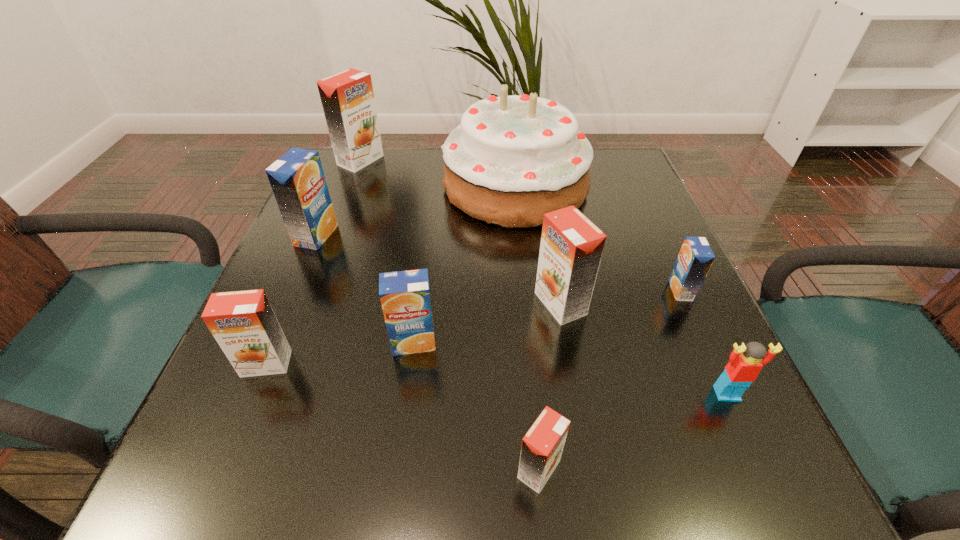
At what (x,y) coordinates should I click in order to perform the action: click on object that is at the far left corner. Please return your answer as a coordinate pair (x, y). The width and height of the screenshot is (960, 540). Looking at the image, I should click on (347, 98).

Locate an element on the screen. The width and height of the screenshot is (960, 540). object located at the far right corner is located at coordinates (512, 159).

Where is `vacant region at the near edge of the desktop`? The image size is (960, 540). vacant region at the near edge of the desktop is located at coordinates (350, 442).

You are a GUI agent. You are given a task and a screenshot of the screen. Output one action in this format:
    pyautogui.click(x=<x>, y=<y>)
    Task: Click on the vacant space at the left edge of the desktop
    
    Given the screenshot: What is the action you would take?
    pos(252,423)

The image size is (960, 540). In the image, there is a desktop. What are the coordinates of `vacant space at the right edge` in the screenshot? It's located at (646, 292).

The image size is (960, 540). Identify the location of vacant space at the near right corner. (733, 496).

Locate an element on the screen. This screenshot has height=540, width=960. vacant space in between the nearest blue orange_juice and the sixth nearest orange juice is located at coordinates (365, 289).

Find the location of `free space that is in between the third nearest orange orange juice and the rightmost orange juice`. free space that is in between the third nearest orange orange juice and the rightmost orange juice is located at coordinates (621, 297).

Find the location of `unoccupied area between the farthest orange orange juice and the second blue orange_juice from left to right`. unoccupied area between the farthest orange orange juice and the second blue orange_juice from left to right is located at coordinates (387, 252).

I want to click on free spot between the farthest orange juice and the second biggest blue orange_juice, so click(387, 252).